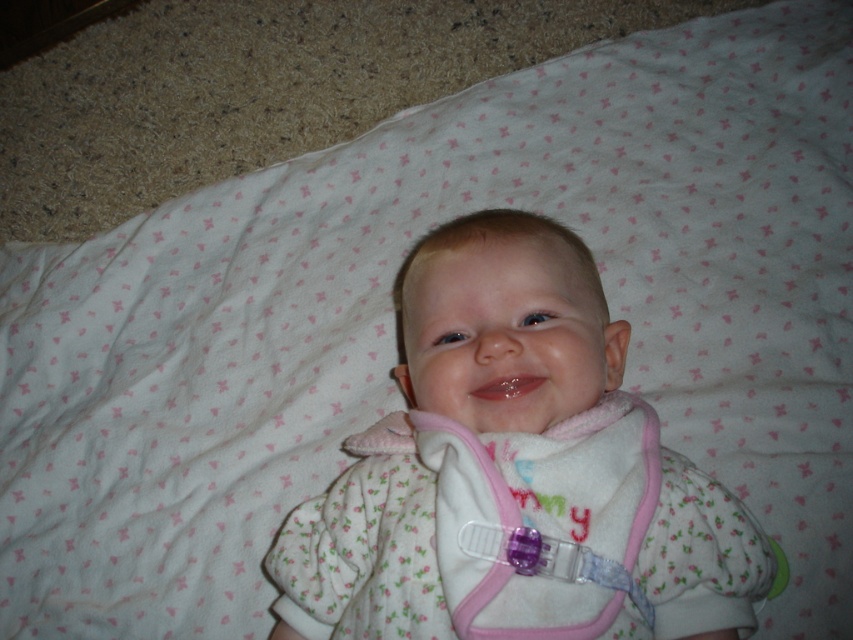
You are a photographer setting up a shoot for a baby product catalog. You have a white fleece baby at center and a pink fleece bib at center in your setup. Based on their sizes, which object should you focus on first to ensure proper framing?

The white fleece baby at center is larger in size than the pink fleece bib at center, so you should focus on the white fleece baby at center first to ensure proper framing.

You are a photographer trying to capture the baby in the image. You need to ensure the pacifier holder is visible in the photo. Based on their positions, will the white fleece baby at center block the view of the pink fleece bib at center?

The white fleece baby at center is above the pink fleece bib at center, so the baby might block the view of the bib depending on the angle. To ensure the pacifier holder is visible, adjust the camera angle to capture both the baby and the bib without obstruction.

You are a photographer setting up a shot of the baby. You need to place a small prop between the white fleece baby at center and the pink fleece bib at center. Where should you position it so it doesn

The white fleece baby at center is taller than the pink fleece bib at center, so you should place the prop between them horizontally, ensuring it is positioned at a height that accommodates both objects.